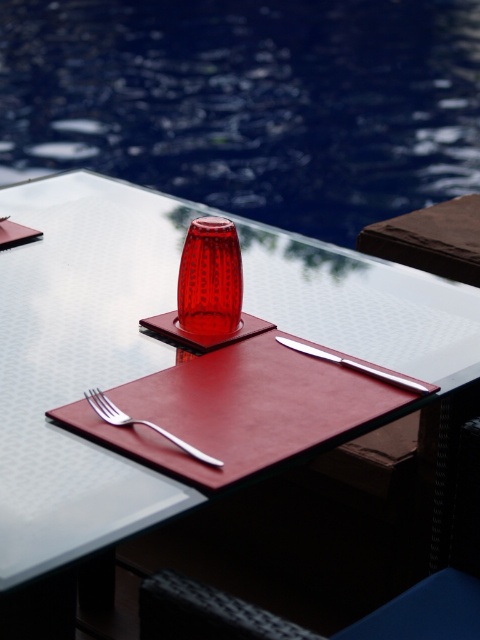
You are a photographer standing at the camera position. You need to place a new decorative plate exactly 1 meter away from the camera, aligned with the point at coordinates point (x=457, y=336). Can you place it there without moving the existing objects?

The distance between point (x=457, y=336) and the camera is 97.34 centimeters. Since 97.34 cm is less than 1 meter, placing the plate exactly 1 meter away would require moving it further away from the camera beyond the current position of point (x=457, y=336). Therefore, you cannot place it there without moving existing objects.

You are holding a camera and want to take a photo of the metallic silver knife at upper center. If the camera is 22.48 inches away from the knife, is this distance sufficient to capture the entire knife in the frame?

The metallic silver knife at upper center and camera are 22.48 inches apart from each other. This distance is sufficient to capture the entire knife in the frame as the knife is likely smaller than the camera frame at that distance.

You are a waiter setting up a table for a customer. You have a satin silver fork at lower left and a polished metal knife at center. Which utensil is narrower?

The satin silver fork at lower left is narrower than the polished metal knife at center.